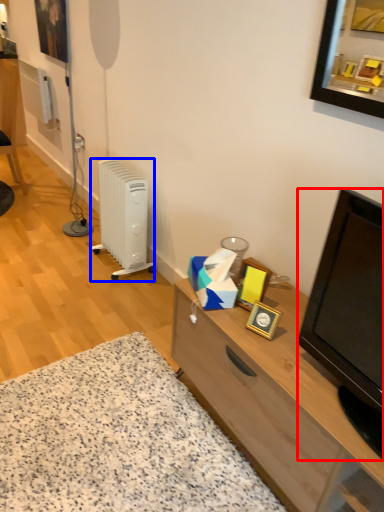
Question: Which object is further to the camera taking this photo, television (highlighted by a red box) or radiator (highlighted by a blue box)?

Choices:
 (A) television
 (B) radiator

Answer: (B)